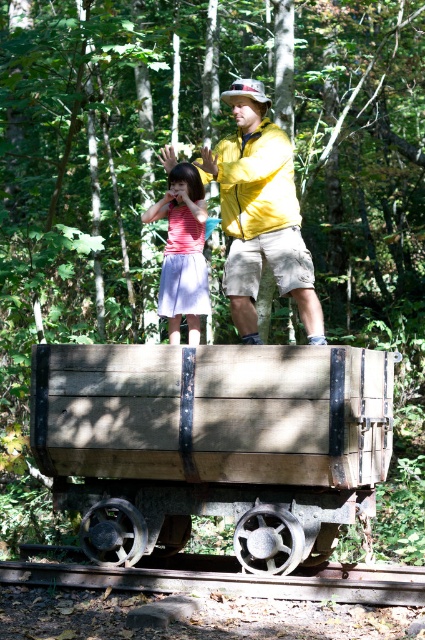
You are standing on the wooden railway wagon and want to step onto the brown wooden train track at bottom. However, you need to know if the pink fabric skirt at center is longer than the track to avoid tripping. Can you determine which one is longer?

The pink fabric skirt at center is longer than the brown wooden train track at bottom according to the description, so you should be cautious as the skirt might obstruct your path.

You are a photographer trying to capture a photo of the pink fabric skirt at center and the brown wooden train track at bottom. Based on their sizes, which object should you focus on first if you want to ensure both are in frame without zooming in or out?

The brown wooden train track at bottom might be wider than pink fabric skirt at center, so you should focus on the brown wooden train track at bottom first to ensure both fit in the frame without zooming.

You are a delivery robot that needs to place a package on the brown wooden train track at bottom. You are currently standing at the yellow matte jacket at upper center. Can you reach the track without moving closer?

The distance between the yellow matte jacket at upper center and the brown wooden train track at bottom is 2.87 meters. Since the robot cannot reach that far without moving closer, it should move forward to place the package on the track.